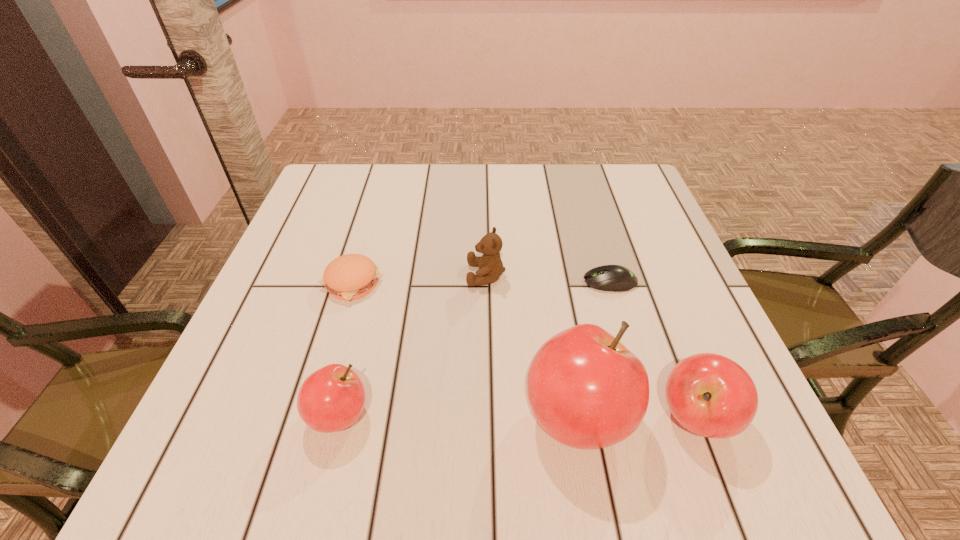
At what (x,y) coordinates should I click in order to perform the action: click on the shortest apple. Please return your answer as a coordinate pair (x, y). Looking at the image, I should click on (332, 398).

The width and height of the screenshot is (960, 540). What are the coordinates of `the second apple from left to right` in the screenshot? It's located at (586, 390).

I want to click on the tallest apple, so click(x=586, y=390).

At what (x,y) coordinates should I click in order to perform the action: click on the rightmost apple. Please return your answer as a coordinate pair (x, y). Looking at the image, I should click on (710, 395).

At what (x,y) coordinates should I click in order to perform the action: click on the fourth object from right to left. Please return your answer as a coordinate pair (x, y). Looking at the image, I should click on (490, 265).

Identify the location of the second shortest object. (351, 276).

I want to click on computer mouse, so click(x=614, y=278).

At what (x,y) coordinates should I click in order to perform the action: click on vacant space located 0.150m on the back of the leftmost apple. Please return your answer as a coordinate pair (x, y). Looking at the image, I should click on (363, 320).

This screenshot has width=960, height=540. Find the location of `vacant area located 0.170m on the back of the tallest object`. vacant area located 0.170m on the back of the tallest object is located at coordinates (557, 300).

Identify the location of free space located 0.210m on the left of the rightmost apple. The image size is (960, 540). (527, 417).